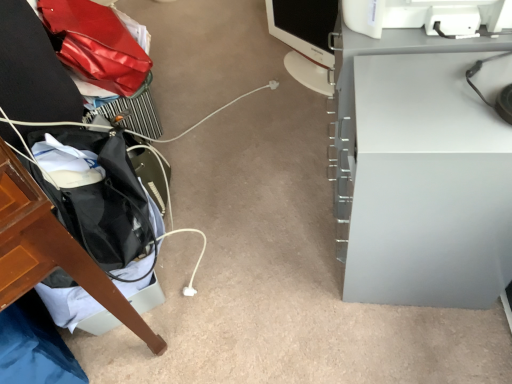
Question: Considering the positions of matte black monitor at center and white matte computer desk at right in the image, is matte black monitor at center bigger or smaller than white matte computer desk at right?

Choices:
 (A) small
 (B) big

Answer: (A)

Question: Looking at their shapes, would you say matte black monitor at center is wider or thinner than white matte computer desk at right?

Choices:
 (A) wide
 (B) thin

Answer: (B)

Question: Considering their positions, is matte black monitor at center located in front of or behind white matte computer desk at right?

Choices:
 (A) front
 (B) behind

Answer: (B)

Question: From a real-world perspective, is white matte computer desk at right positioned above or below matte black monitor at center?

Choices:
 (A) above
 (B) below

Answer: (A)

Question: In terms of width, does white matte computer desk at right look wider or thinner when compared to matte black monitor at center?

Choices:
 (A) thin
 (B) wide

Answer: (B)

Question: Considering their positions, is white matte computer desk at right located in front of or behind matte black monitor at center?

Choices:
 (A) front
 (B) behind

Answer: (A)

Question: Considering the positions of white matte computer desk at right and matte black monitor at center in the image, is white matte computer desk at right bigger or smaller than matte black monitor at center?

Choices:
 (A) small
 (B) big

Answer: (B)